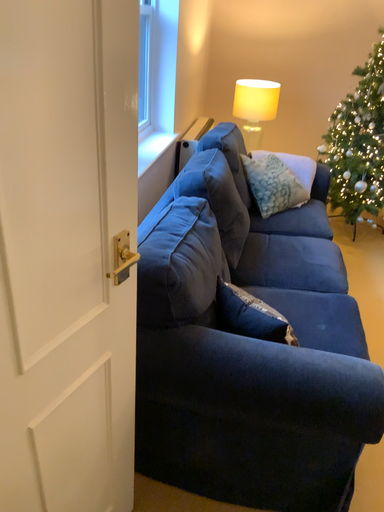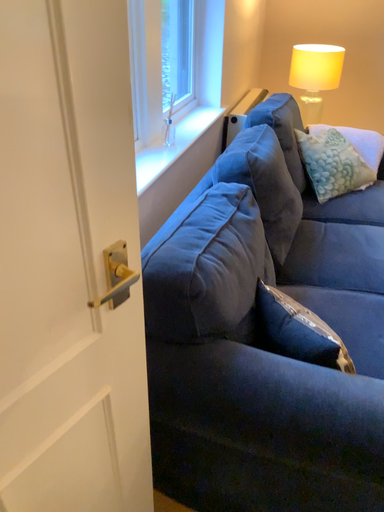
Question: How did the camera likely rotate when shooting the video?

Choices:
 (A) rotated right
 (B) rotated left

Answer: (B)